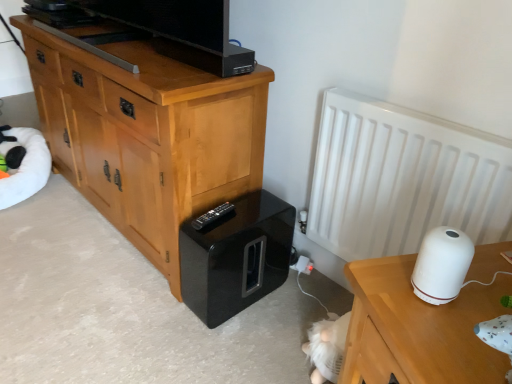
Where is `vacant space to the right of white glossy humidifier at right`? vacant space to the right of white glossy humidifier at right is located at coordinates (482, 284).